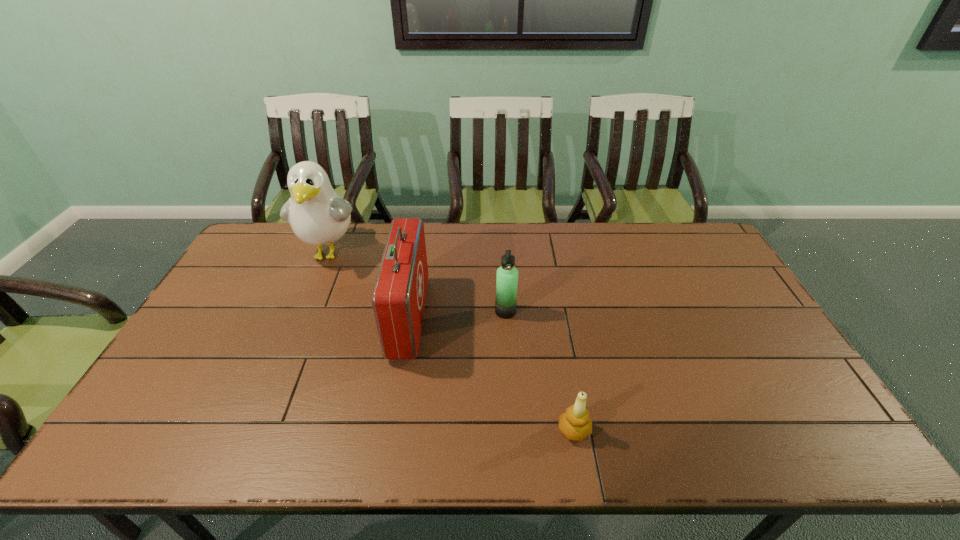
Where is `free space that satisfies the following two spatial constraints: 1. on the side of the candle_holder with the first aid cross symbol; 2. on the left side of the third object from right to left`? The width and height of the screenshot is (960, 540). free space that satisfies the following two spatial constraints: 1. on the side of the candle_holder with the first aid cross symbol; 2. on the left side of the third object from right to left is located at coordinates (390, 430).

This screenshot has height=540, width=960. In order to click on blank area in the image that satisfies the following two spatial constraints: 1. on the side of the first-aid kit with the first aid cross symbol; 2. on the back side of the shortest object in this screenshot , I will do `click(390, 430)`.

Image resolution: width=960 pixels, height=540 pixels. I want to click on free spot that satisfies the following two spatial constraints: 1. on the side of the shortest object with the first aid cross symbol; 2. on the right side of the first-aid kit, so click(390, 430).